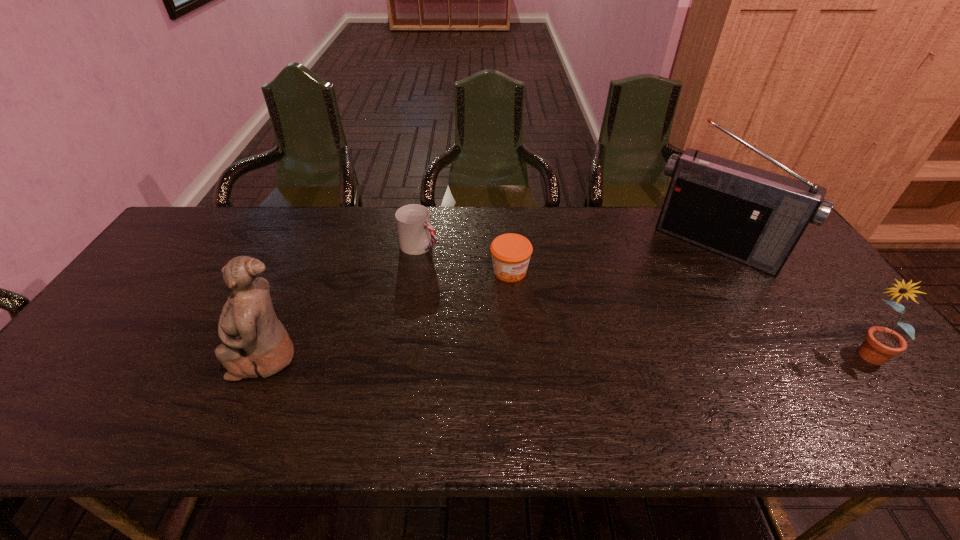
Identify the location of the second tallest object. Image resolution: width=960 pixels, height=540 pixels. (255, 343).

Find the location of `figurine`. figurine is located at coordinates (255, 343).

Locate an element on the screen. sunflower is located at coordinates [x=881, y=343].

I want to click on the third object from right to left, so click(511, 253).

At what (x,y) coordinates should I click in order to perform the action: click on the shortest object. Please return your answer as a coordinate pair (x, y). Image resolution: width=960 pixels, height=540 pixels. Looking at the image, I should click on (511, 253).

This screenshot has width=960, height=540. I want to click on cup, so click(416, 235).

This screenshot has width=960, height=540. In order to click on the second shortest object in this screenshot , I will do `click(416, 235)`.

Locate an element on the screen. This screenshot has height=540, width=960. radio receiver is located at coordinates (x=755, y=217).

Locate an element on the screen. free space located 0.390m on the front-facing side of the leftmost object is located at coordinates (75, 355).

Locate an element on the screen. This screenshot has width=960, height=540. vacant space located on the front-facing side of the leftmost object is located at coordinates (79, 355).